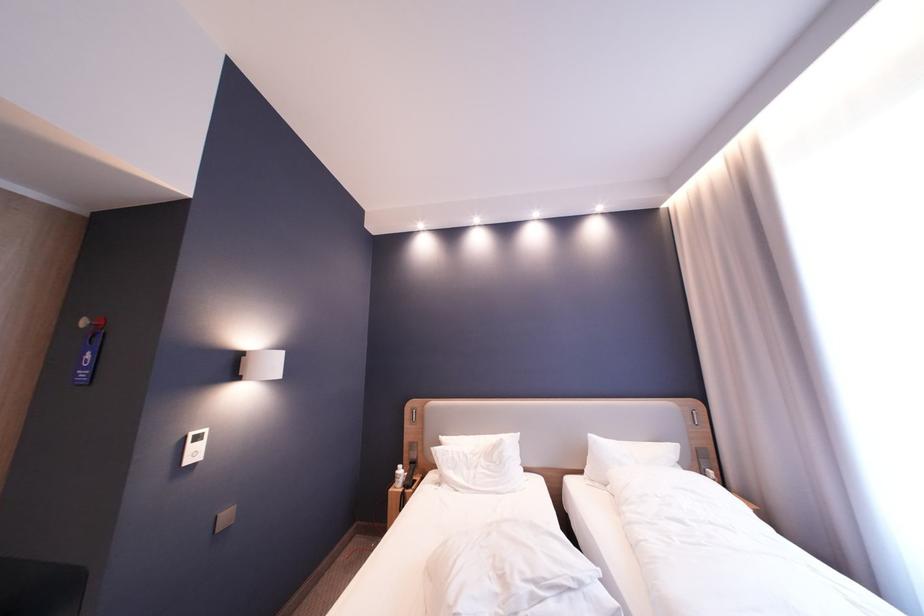
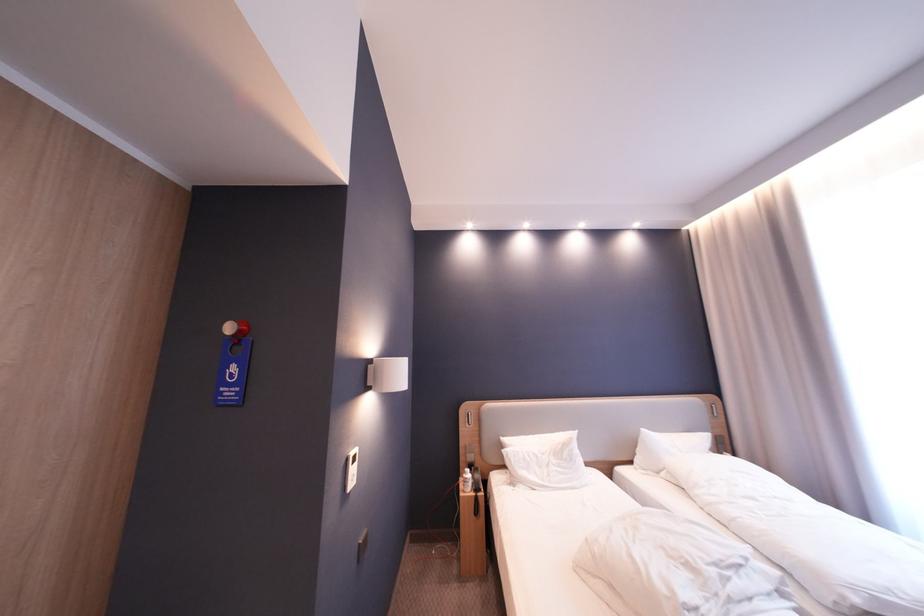
The point at (591,472) is marked in the first image. Where is the corresponding point in the second image?

(641, 464)